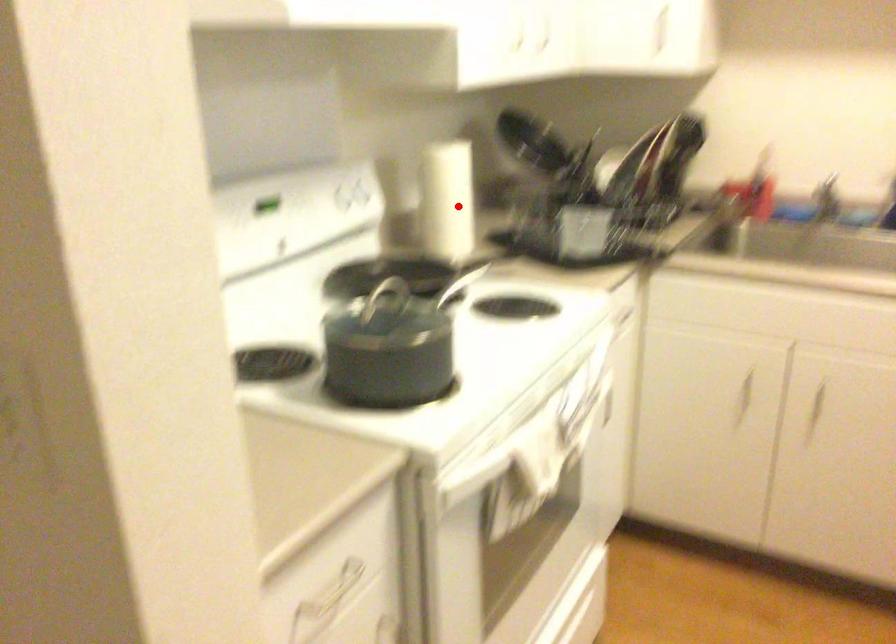
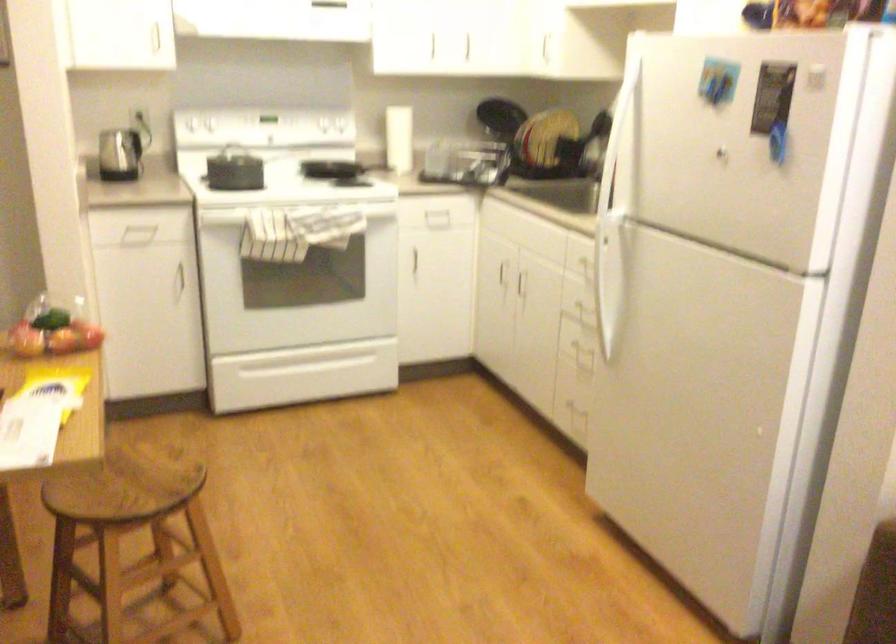
Question: I am providing you with two images of the same scene from different viewpoints. A red point is shown in image1. For the corresponding object point in image2, is it positioned nearer or farther from the camera?

Choices:
 (A) Nearer
 (B) Farther

Answer: (B)